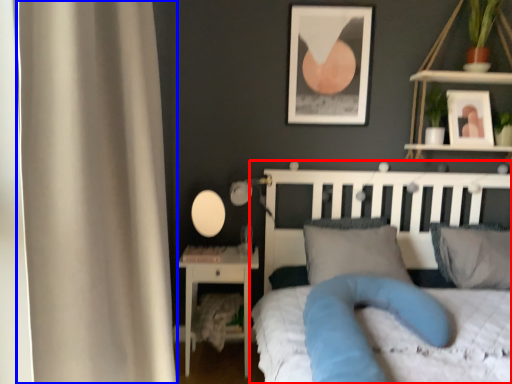
Question: Which of the following is the farthest to the observer, bed (highlighted by a red box) or curtain (highlighted by a blue box)?

Choices:
 (A) bed
 (B) curtain

Answer: (B)